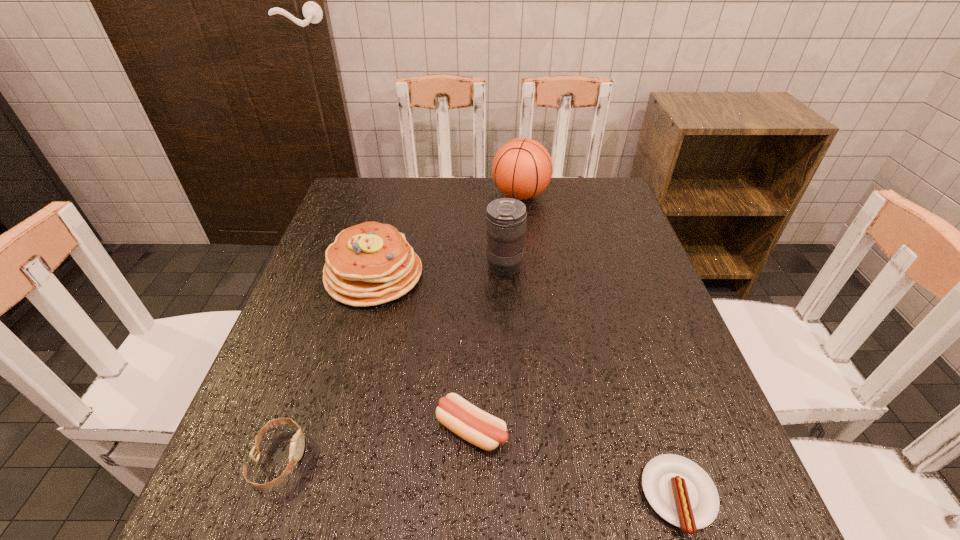
Identify the location of object that is at the right edge. This screenshot has height=540, width=960. (679, 490).

The width and height of the screenshot is (960, 540). What are the coordinates of `object that is positioned at the near left corner` in the screenshot? It's located at (297, 444).

At what (x,y) coordinates should I click in order to perform the action: click on object positioned at the near right corner. Please return your answer as a coordinate pair (x, y). Image resolution: width=960 pixels, height=540 pixels. Looking at the image, I should click on (679, 490).

The image size is (960, 540). In order to click on vacant space at the far edge of the desktop in this screenshot , I will do `click(448, 183)`.

The image size is (960, 540). What are the coordinates of `free location at the left edge of the desktop` in the screenshot? It's located at (296, 297).

Locate an element on the screen. The width and height of the screenshot is (960, 540). vacant space at the right edge is located at coordinates (653, 296).

Find the location of a particular element. vacant space at the far right corner is located at coordinates (590, 208).

Where is `vacant area at the near right corner`? vacant area at the near right corner is located at coordinates (732, 505).

The image size is (960, 540). Find the location of `unoccupied area between the shortest object and the telephoto lens`. unoccupied area between the shortest object and the telephoto lens is located at coordinates (591, 381).

I want to click on vacant area between the shortest object and the watch, so click(x=479, y=477).